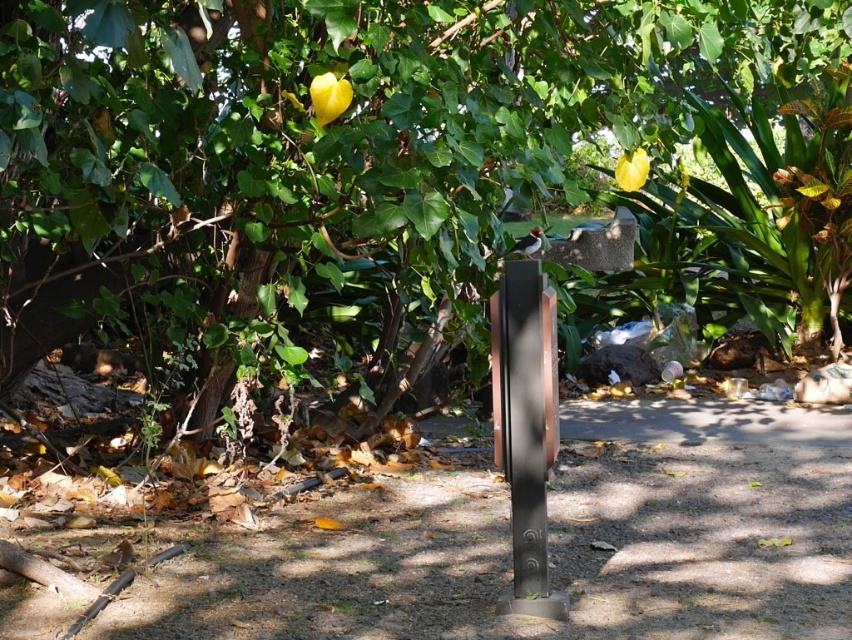
You are standing in the park and see the green leafy tree at center and the metallic gray post at center. Which object is positioned to the left side from your perspective?

The green leafy tree at center is positioned to the left of the metallic gray post at center, so it is on the left side from your perspective.

Consider the image. You are standing at point (519, 445) and want to walk to point (153, 152). Based on the scene description, will you have an unobstructed path? Explain your reasoning using the coordinates provided.

The path between point (153, 152) and point (519, 445) is obstructed because point (153, 152) is behind point (519, 445), meaning there is an object blocking the direct route between them.